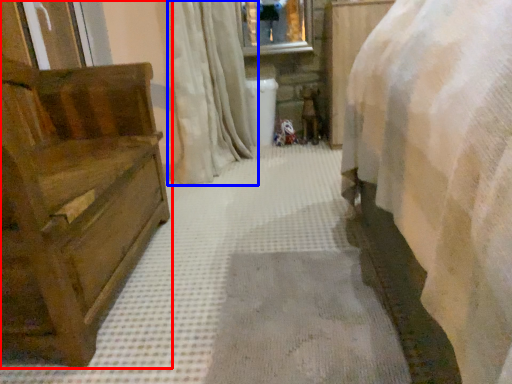
Question: Among these objects, which one is farthest to the camera, furniture (highlighted by a red box) or curtain (highlighted by a blue box)?

Choices:
 (A) furniture
 (B) curtain

Answer: (B)